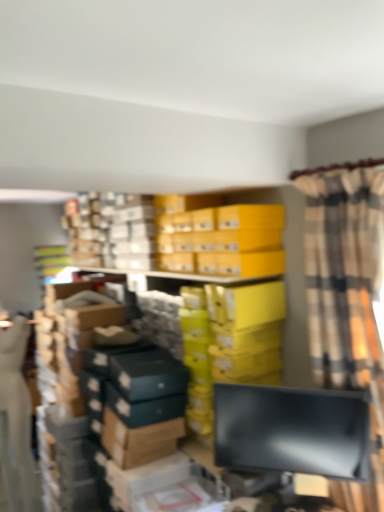
Question: Looking at their shapes, would you say plaid fabric curtain at right is wider or thinner than matte black monitor at lower right?

Choices:
 (A) thin
 (B) wide

Answer: (B)

Question: Is plaid fabric curtain at right inside the boundaries of matte black monitor at lower right, or outside?

Choices:
 (A) outside
 (B) inside

Answer: (A)

Question: Based on their relative distances, which object is farther from the plaid fabric curtain at right?

Choices:
 (A) matte black monitor at lower right
 (B) yellow cardboard boxes at upper center

Answer: (B)

Question: Estimate the real-world distances between objects in this image. Which object is farther from the matte black monitor at lower right?

Choices:
 (A) plaid fabric curtain at right
 (B) yellow cardboard boxes at upper center

Answer: (B)